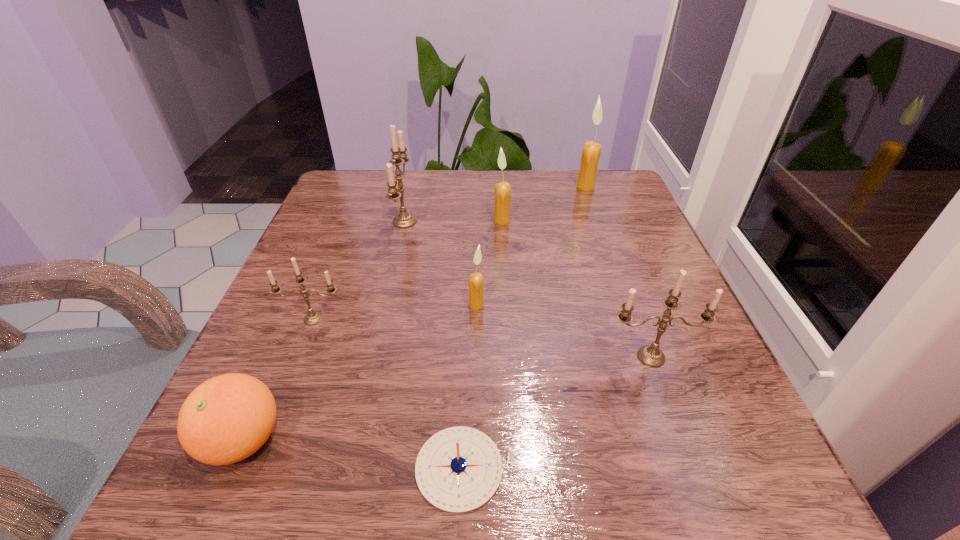
Locate an element on the screen. the farthest metallic candle is located at coordinates (404, 220).

Identify the location of the second metallic candle from left to right. This screenshot has width=960, height=540. (404, 220).

What are the coordinates of `the farthest cream candle` in the screenshot? It's located at (591, 152).

You are a GUI agent. You are given a task and a screenshot of the screen. Output one action in this format:
    pyautogui.click(x=<x>, y=<y>)
    Task: Click on the biggest cream candle
    
    Given the screenshot: What is the action you would take?
    pyautogui.click(x=591, y=152)

Locate an element on the screen. Image resolution: width=960 pixels, height=540 pixels. the sixth object from left to right is located at coordinates (502, 190).

Image resolution: width=960 pixels, height=540 pixels. I want to click on the second biggest cream candle, so click(502, 190).

I want to click on the nearest metallic candle, so click(x=650, y=355).

At what (x,y) coordinates should I click in order to perform the action: click on the rightmost metallic candle. Please return your answer as a coordinate pair (x, y). This screenshot has width=960, height=540. Looking at the image, I should click on (650, 355).

Where is `the nearest cream candle`? The width and height of the screenshot is (960, 540). the nearest cream candle is located at coordinates (476, 302).

Identify the location of the smallest cream candle. The height and width of the screenshot is (540, 960). (476, 302).